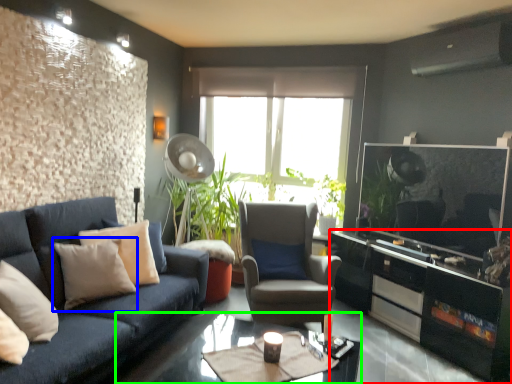
Question: Considering the real-world distances, which object is farthest from cabinetry (highlighted by a red box)? pillow (highlighted by a blue box) or coffee table (highlighted by a green box)?

Choices:
 (A) pillow
 (B) coffee table

Answer: (A)